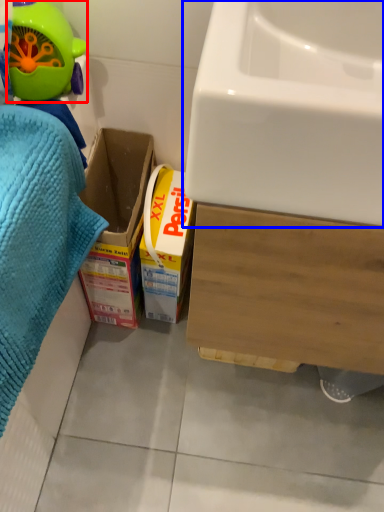
Question: Among these objects, which one is nearest to the camera, toy (highlighted by a red box) or sink (highlighted by a blue box)?

Choices:
 (A) toy
 (B) sink

Answer: (B)